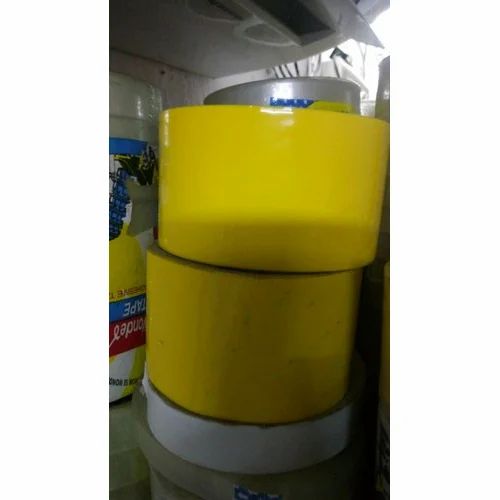
I want to click on opening in concrete ceiling, so click(x=294, y=7).